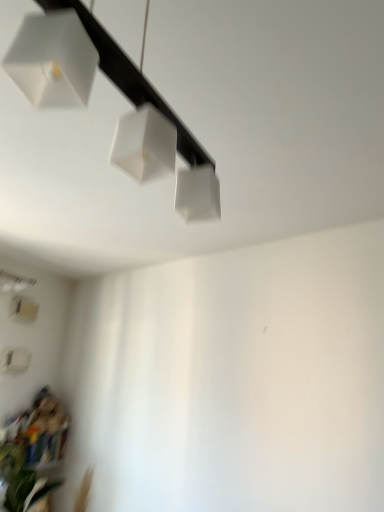
Question: From the image's perspective, does white matte lamp at upper center, which is the first lamp in front-to-back order, appear lower than white matte lampshade at lower left, arranged as the first lamp when viewed from the back?

Choices:
 (A) yes
 (B) no

Answer: (B)

Question: Is white matte lamp at upper center, the second lamp viewed from the left, oriented towards white matte lampshade at lower left, positioned as the first lamp in left-to-right order?

Choices:
 (A) yes
 (B) no

Answer: (B)

Question: From a real-world perspective, is white matte lamp at upper center, acting as the first lamp starting from the top, physically below white matte lampshade at lower left, positioned as the second lamp in top-to-bottom order?

Choices:
 (A) yes
 (B) no

Answer: (B)

Question: Does white matte lamp at upper center, positioned as the second lamp in bottom-to-top order, have a lesser width compared to white matte lampshade at lower left, arranged as the first lamp when viewed from the back?

Choices:
 (A) yes
 (B) no

Answer: (B)

Question: Would you say white matte lampshade at lower left, positioned as the first lamp in left-to-right order, is part of white matte lamp at upper center, the second lamp viewed from the left,'s contents?

Choices:
 (A) yes
 (B) no

Answer: (B)

Question: Is green leafy plant at lower left situated inside white matte lamp at upper center, positioned as the second lamp in bottom-to-top order, or outside?

Choices:
 (A) inside
 (B) outside

Answer: (B)

Question: Looking at their shapes, would you say green leafy plant at lower left is wider or thinner than white matte lamp at upper center, positioned as the second lamp in bottom-to-top order?

Choices:
 (A) thin
 (B) wide

Answer: (B)

Question: From the image's perspective, is green leafy plant at lower left positioned above or below white matte lamp at upper center, acting as the first lamp starting from the right?

Choices:
 (A) below
 (B) above

Answer: (A)

Question: From a real-world perspective, relative to white matte lamp at upper center, acting as the first lamp starting from the right, is green leafy plant at lower left vertically above or below?

Choices:
 (A) below
 (B) above

Answer: (A)

Question: Is green leafy plant at lower left taller or shorter than white matte lampshade at lower left, the first lamp positioned from the bottom?

Choices:
 (A) tall
 (B) short

Answer: (B)

Question: Considering their positions, is green leafy plant at lower left located in front of or behind white matte lampshade at lower left, positioned as the first lamp in left-to-right order?

Choices:
 (A) behind
 (B) front

Answer: (B)

Question: Considering the relative positions of green leafy plant at lower left and white matte lampshade at lower left, positioned as the second lamp in top-to-bottom order, in the image provided, is green leafy plant at lower left to the left or to the right of white matte lampshade at lower left, positioned as the second lamp in top-to-bottom order,?

Choices:
 (A) left
 (B) right

Answer: (B)

Question: From a real-world perspective, is green leafy plant at lower left positioned above or below white matte lampshade at lower left, arranged as the first lamp when viewed from the back?

Choices:
 (A) above
 (B) below

Answer: (B)

Question: Based on their sizes in the image, would you say white matte lamp at upper center, acting as the first lamp starting from the right, is bigger or smaller than green leafy plant at lower left?

Choices:
 (A) small
 (B) big

Answer: (B)

Question: From a real-world perspective, relative to green leafy plant at lower left, is white matte lamp at upper center, acting as the first lamp starting from the top, vertically above or below?

Choices:
 (A) above
 (B) below

Answer: (A)